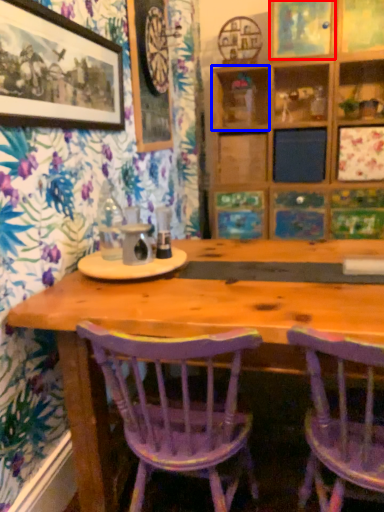
Question: Which object is further to the camera taking this photo, decorative picture (highlighted by a red box) or shelf (highlighted by a blue box)?

Choices:
 (A) decorative picture
 (B) shelf

Answer: (B)